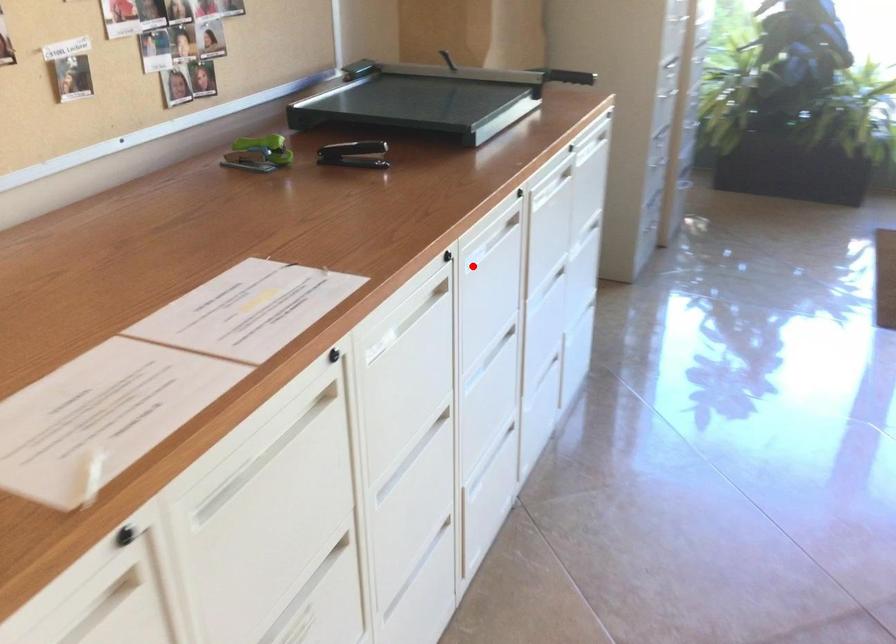
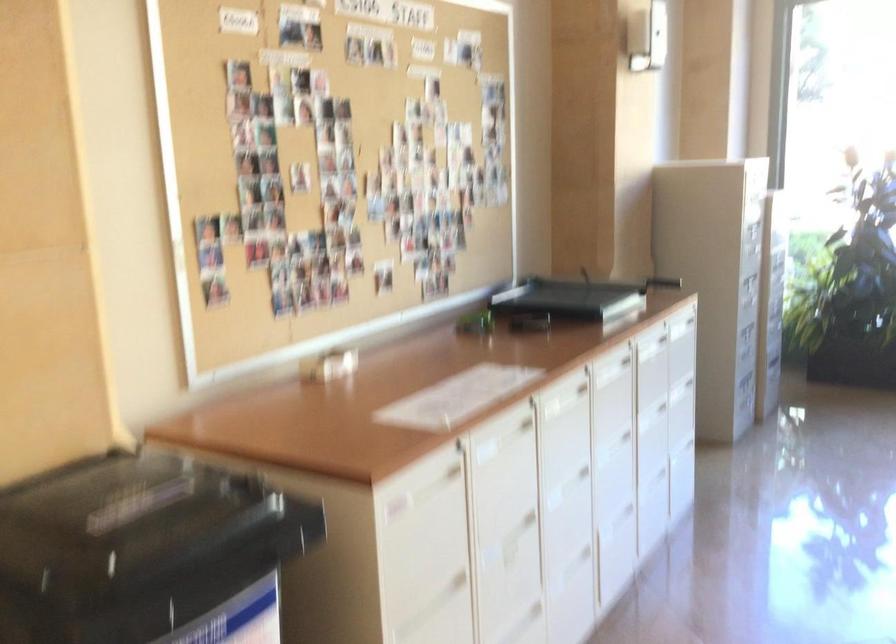
Question: I am providing you with two images of the same scene from different viewpoints. A red point is shown in image1. For the corresponding object point in image2, is it positioned nearer or farther from the camera?

Choices:
 (A) Nearer
 (B) Farther

Answer: (B)